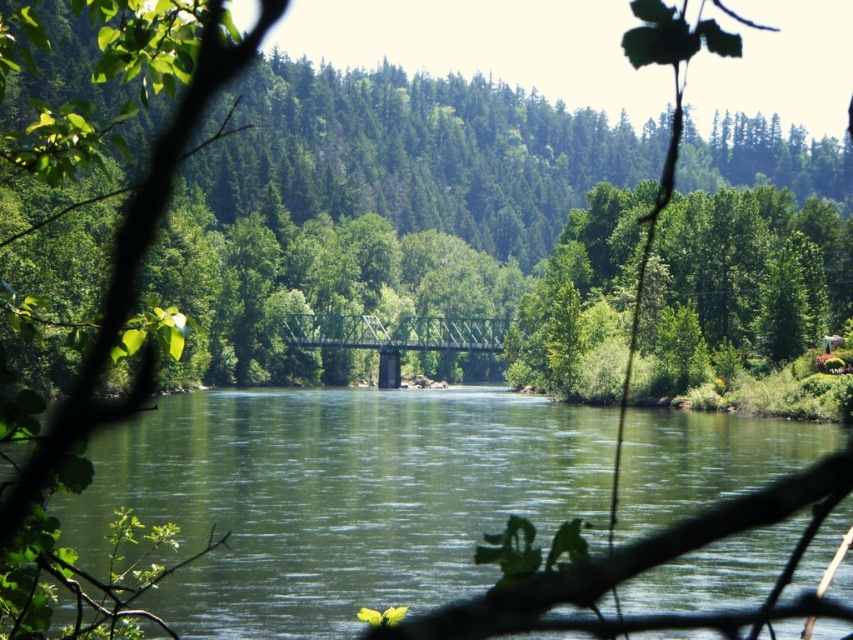
Question: Does green smooth water at center have a lesser width compared to green leafy tree at center?

Choices:
 (A) yes
 (B) no

Answer: (B)

Question: Is green matte tree at center below green leafy tree at center?

Choices:
 (A) no
 (B) yes

Answer: (A)

Question: Does green smooth water at center have a smaller size compared to green leafy tree at center?

Choices:
 (A) yes
 (B) no

Answer: (A)

Question: Estimate the real-world distances between objects in this image. Which object is farther from the green matte tree at center?

Choices:
 (A) green metallic bridge at center
 (B) green smooth water at center

Answer: (B)

Question: Estimate the real-world distances between objects in this image. Which object is farther from the green matte tree at center?

Choices:
 (A) green leafy tree at center
 (B) green smooth water at center

Answer: (B)

Question: Estimate the real-world distances between objects in this image. Which object is closer to the green smooth water at center?

Choices:
 (A) green metallic bridge at center
 (B) green leafy tree at center

Answer: (B)